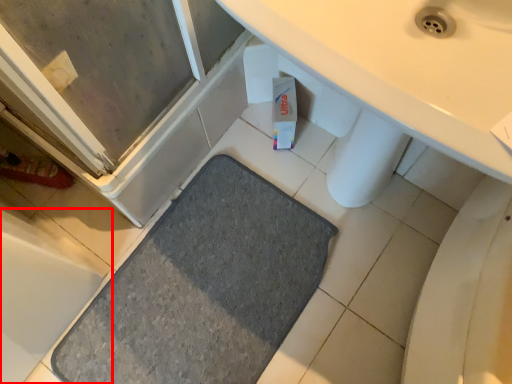
Question: From the image's perspective, where is bath (annotated by the red box) located in relation to bath mat in the image?

Choices:
 (A) above
 (B) below

Answer: (A)